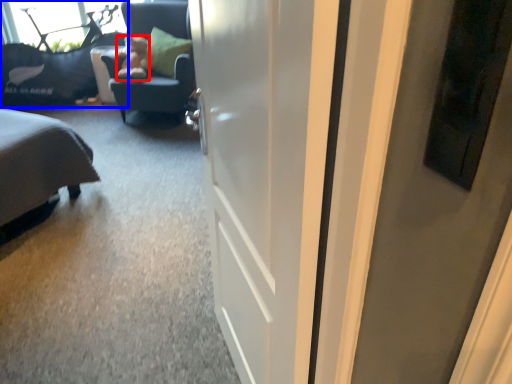
Question: Which point is further to the camera, teddy (highlighted by a red box) or furniture (highlighted by a blue box)?

Choices:
 (A) teddy
 (B) furniture

Answer: (B)